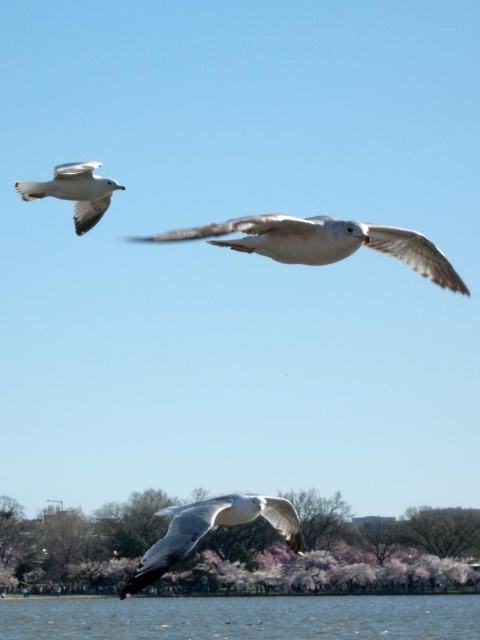
Question: Can you confirm if white feathered bird at lower center is positioned above white feathered bird at left?

Choices:
 (A) yes
 (B) no

Answer: (B)

Question: Does white feathered bird at center have a smaller size compared to white feathered bird at left?

Choices:
 (A) no
 (B) yes

Answer: (A)

Question: Which of the following is the closest to the observer?

Choices:
 (A) (212, 518)
 (B) (68, 179)
 (C) (267, 627)

Answer: (A)

Question: Which object is the closest to the clear water at lower center?

Choices:
 (A) white feathered bird at center
 (B) pink blossoming tree at lower center
 (C) white feathered bird at lower center

Answer: (B)

Question: Does white feathered bird at lower center have a smaller size compared to white feathered bird at left?

Choices:
 (A) no
 (B) yes

Answer: (B)

Question: Estimate the real-world distances between objects in this image. Which object is farther from the white feathered bird at lower center?

Choices:
 (A) pink blossoming tree at lower center
 (B) white feathered bird at center

Answer: (A)